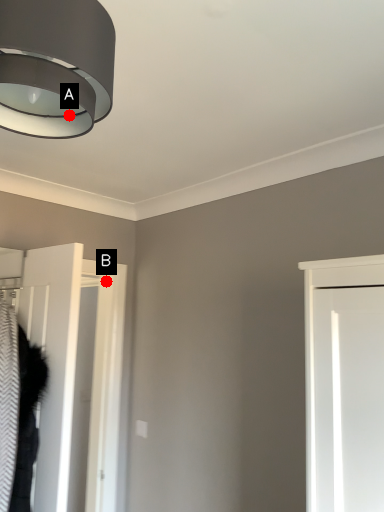
Question: Two points are circled on the image, labeled by A and B beside each circle. Which of the following is the farthest from the observer?

Choices:
 (A) A is further
 (B) B is further

Answer: (B)